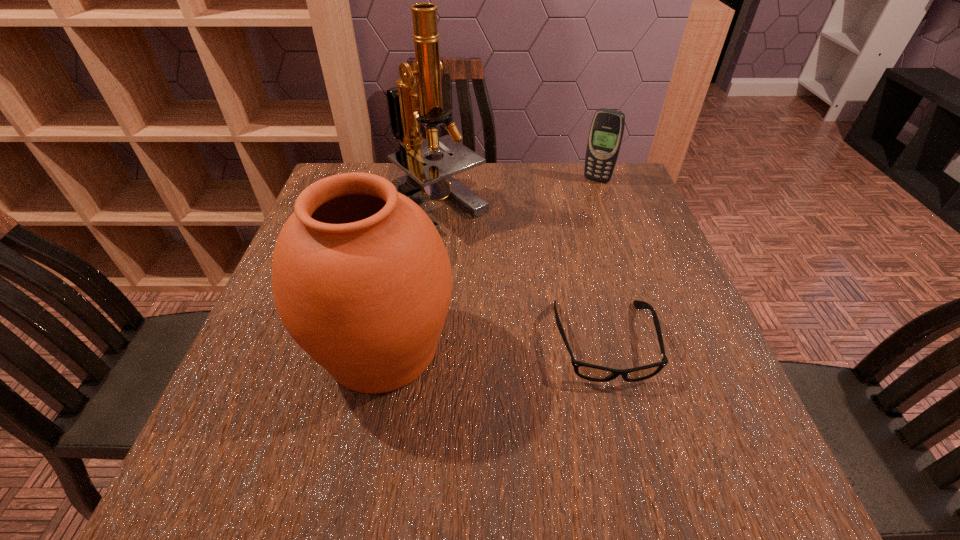
This screenshot has width=960, height=540. Find the location of `the second tallest object`. the second tallest object is located at coordinates (362, 281).

This screenshot has width=960, height=540. Identify the location of spectacles. (591, 372).

Where is `cellular telephone`? cellular telephone is located at coordinates (606, 132).

Where is `the tallest object`? This screenshot has height=540, width=960. the tallest object is located at coordinates (425, 178).

At what (x,y) coordinates should I click in order to perform the action: click on vacant area located on the back of the urn. Please return your answer as a coordinate pair (x, y). Looking at the image, I should click on (398, 267).

Where is `vacant space positioned on the front-facing side of the shortest object`? The image size is (960, 540). vacant space positioned on the front-facing side of the shortest object is located at coordinates (625, 425).

Image resolution: width=960 pixels, height=540 pixels. What are the coordinates of `vacant space located on the screen of the second shortest object` in the screenshot? It's located at (553, 252).

You are a GUI agent. You are given a task and a screenshot of the screen. Output one action in this format:
    pyautogui.click(x=<x>, y=<y>)
    Task: Click on the free space located on the screen of the second shortest object
    This screenshot has height=540, width=960.
    Given the screenshot: What is the action you would take?
    click(x=562, y=238)

Where is `free spot located 0.280m on the screen of the second shortest object`? Image resolution: width=960 pixels, height=540 pixels. free spot located 0.280m on the screen of the second shortest object is located at coordinates (560, 240).

At what (x,y) coordinates should I click in order to perform the action: click on vacant region located at the eyepiece of the microscope. Please return your answer as a coordinate pair (x, y). The width and height of the screenshot is (960, 540). Looking at the image, I should click on (465, 301).